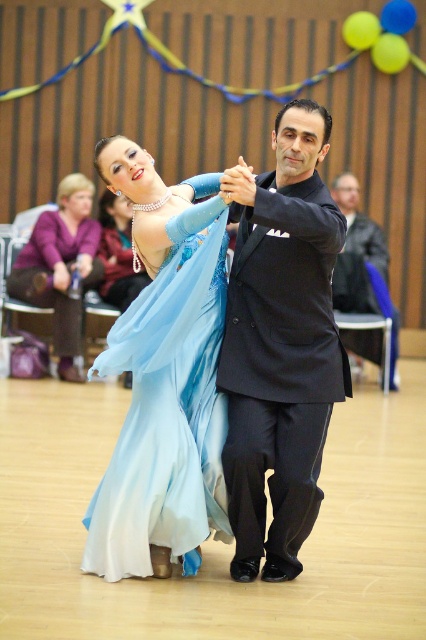
Which is above, light blue satin dress at center or black smooth suit at center?

Positioned higher is black smooth suit at center.

Is light blue satin dress at center shorter than black smooth suit at center?

No.

Who is more distant from viewer, [86,556] or [348,241]?

Positioned behind is point [348,241].

Find the location of a particular element. light blue satin dress at center is located at coordinates (166, 410).

Between point (26, 257) and point (367, 230), which one is positioned in front?

Point (26, 257)

In the scene shown: Which is more to the left, matte purple dress at upper left or black smooth suit at center?

Positioned to the left is matte purple dress at upper left.

Describe the element at coordinates (60, 266) in the screenshot. I see `matte purple dress at upper left` at that location.

You are a GUI agent. You are given a task and a screenshot of the screen. Output one action in this format:
    pyautogui.click(x=<x>, y=<y>)
    Task: Click on the matte purple dress at upper left
    
    Given the screenshot: What is the action you would take?
    pyautogui.click(x=60, y=266)

Is point (268, 547) more distant than point (331, 189)?

No, it is not.

Can you confirm if black satin suit at center is positioned above black smooth suit at center?

No.

Identify the location of black satin suit at center. (279, 342).